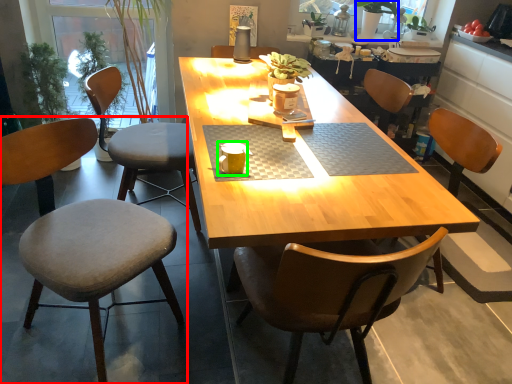
Question: Which object is the closest to the chair (highlighted by a red box)? Choose among these: houseplant (highlighted by a blue box) or coffee cup (highlighted by a green box).

Choices:
 (A) houseplant
 (B) coffee cup

Answer: (B)